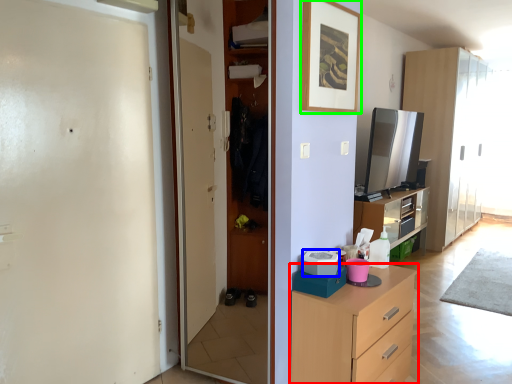
Question: Considering the real-world distances, which object is closest to chest of drawers (highlighted by a red box)? appliance (highlighted by a blue box) or picture frame (highlighted by a green box).

Choices:
 (A) appliance
 (B) picture frame

Answer: (A)